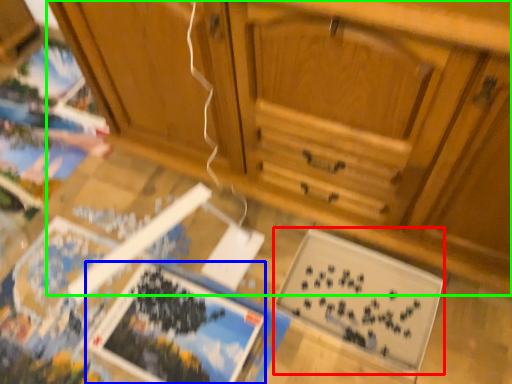
Question: Based on their relative distances, which object is nearer to magazine (highlighted by a red box)? Choose from magazine (highlighted by a blue box) and cabinetry (highlighted by a green box).

Choices:
 (A) magazine
 (B) cabinetry

Answer: (A)